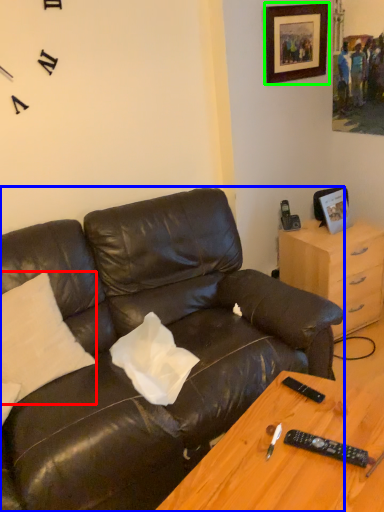
Question: Which object is the closest to the pillow (highlighted by a red box)? Choose among these: studio couch (highlighted by a blue box) or picture frame (highlighted by a green box).

Choices:
 (A) studio couch
 (B) picture frame

Answer: (A)